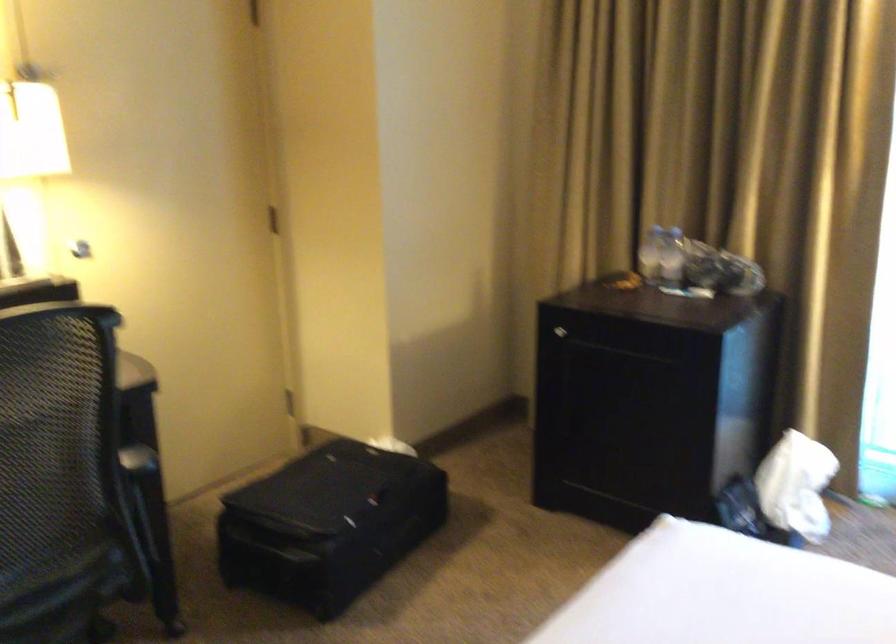
This screenshot has width=896, height=644. Identify the location of cabinet door handle. (560, 330).